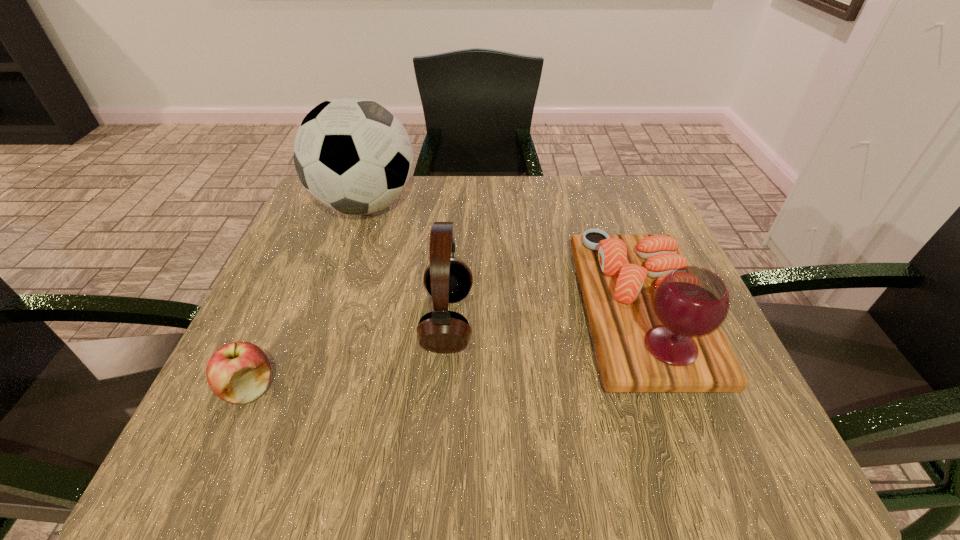
The width and height of the screenshot is (960, 540). Find the location of `soccer ball located in the left edge section of the desktop`. soccer ball located in the left edge section of the desktop is located at coordinates (353, 155).

This screenshot has height=540, width=960. I want to click on apple present at the left edge, so click(239, 372).

Identify the location of object that is positioned at the right edge. The height and width of the screenshot is (540, 960). (655, 321).

Where is `object that is at the far left corner`? The height and width of the screenshot is (540, 960). object that is at the far left corner is located at coordinates (353, 155).

This screenshot has width=960, height=540. I want to click on vacant space at the far edge of the desktop, so click(468, 180).

Find the location of a particular element. free spot at the near edge of the desktop is located at coordinates (653, 464).

Identify the location of vacant space at the left edge of the desktop. (314, 316).

Where is `vacant area at the far left corner`? vacant area at the far left corner is located at coordinates (305, 219).

Where is `vacant space at the far right corner of the desktop`? This screenshot has height=540, width=960. vacant space at the far right corner of the desktop is located at coordinates (618, 198).

Identify the location of vacant region at the near right corner. The image size is (960, 540). (724, 417).